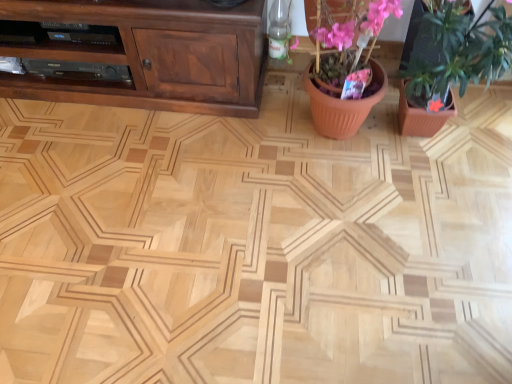
Question: From a real-world perspective, is terracotta pot at center on top of pink matte flower pot at upper right?

Choices:
 (A) yes
 (B) no

Answer: (B)

Question: Would you say terracotta pot at center contains pink matte flower pot at upper right?

Choices:
 (A) yes
 (B) no

Answer: (B)

Question: Considering the relative positions of terracotta pot at center and pink matte flower pot at upper right in the image provided, is terracotta pot at center to the left of pink matte flower pot at upper right from the viewer's perspective?

Choices:
 (A) no
 (B) yes

Answer: (B)

Question: From the image's perspective, is terracotta pot at center under pink matte flower pot at upper right?

Choices:
 (A) yes
 (B) no

Answer: (B)

Question: Can you confirm if terracotta pot at center is positioned to the right of pink matte flower pot at upper right?

Choices:
 (A) yes
 (B) no

Answer: (B)

Question: Considering the positions of point (498, 36) and point (372, 33), is point (498, 36) closer or farther from the camera than point (372, 33)?

Choices:
 (A) closer
 (B) farther

Answer: (B)

Question: In terms of height, does pink matte flower pot at upper right look taller or shorter compared to terracotta pot at center?

Choices:
 (A) tall
 (B) short

Answer: (A)

Question: Is pink matte flower pot at upper right to the left or to the right of terracotta pot at center in the image?

Choices:
 (A) left
 (B) right

Answer: (B)

Question: From a real-world perspective, is pink matte flower pot at upper right positioned above or below terracotta pot at center?

Choices:
 (A) above
 (B) below

Answer: (A)

Question: From a real-world perspective, relative to pink matte flower pot at upper right, is brown wood cabinet at upper left vertically above or below?

Choices:
 (A) above
 (B) below

Answer: (B)

Question: Considering the positions of brown wood cabinet at upper left and pink matte flower pot at upper right in the image, is brown wood cabinet at upper left wider or thinner than pink matte flower pot at upper right?

Choices:
 (A) thin
 (B) wide

Answer: (A)

Question: Relative to pink matte flower pot at upper right, is brown wood cabinet at upper left in front or behind?

Choices:
 (A) behind
 (B) front

Answer: (A)

Question: Considering the positions of point (34, 51) and point (502, 21), is point (34, 51) closer or farther from the camera than point (502, 21)?

Choices:
 (A) farther
 (B) closer

Answer: (A)

Question: Relative to terracotta pot at center, is brown wood cabinet at upper left in front or behind?

Choices:
 (A) front
 (B) behind

Answer: (B)

Question: Considering the positions of point (94, 97) and point (385, 76), is point (94, 97) closer or farther from the camera than point (385, 76)?

Choices:
 (A) farther
 (B) closer

Answer: (A)